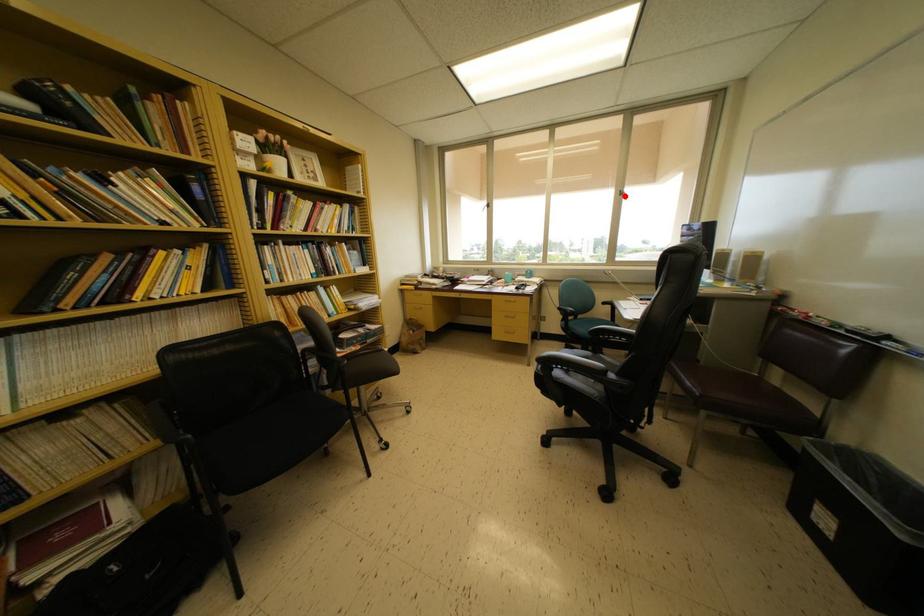
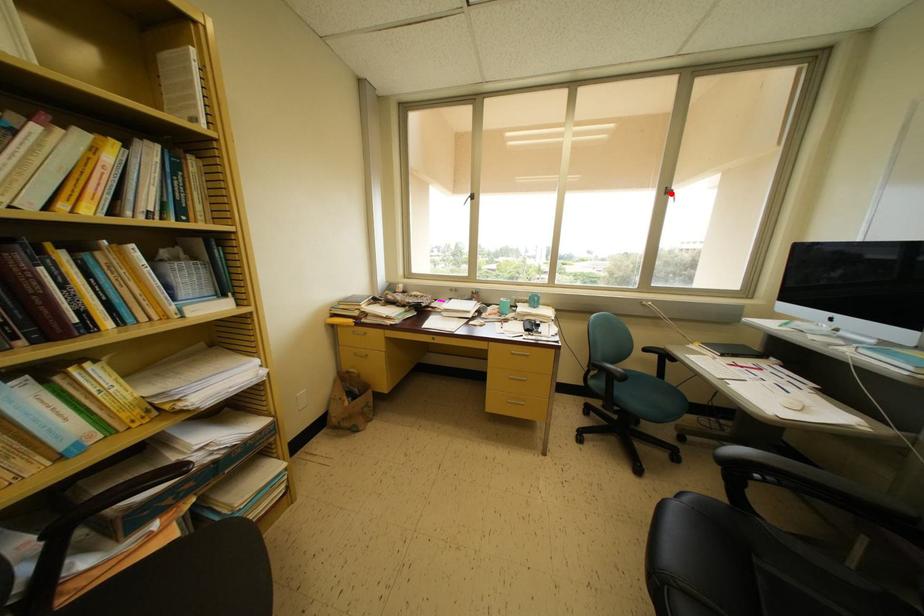
I am providing you with two images of the same scene from different viewpoints. A red point is marked on the first image and another point is marked on the second image. Is the marked point in image1 the same physical position as the marked point in image2?

Yes